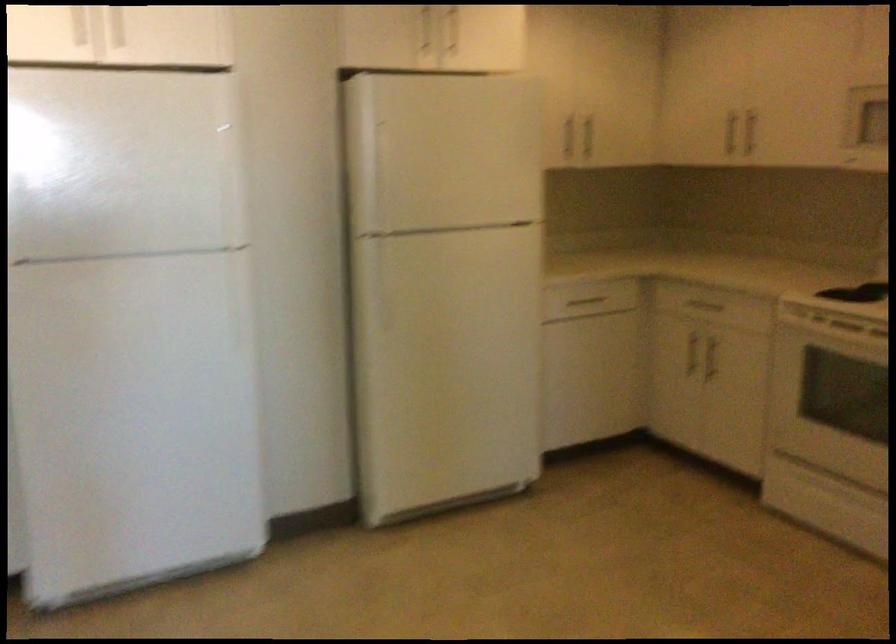
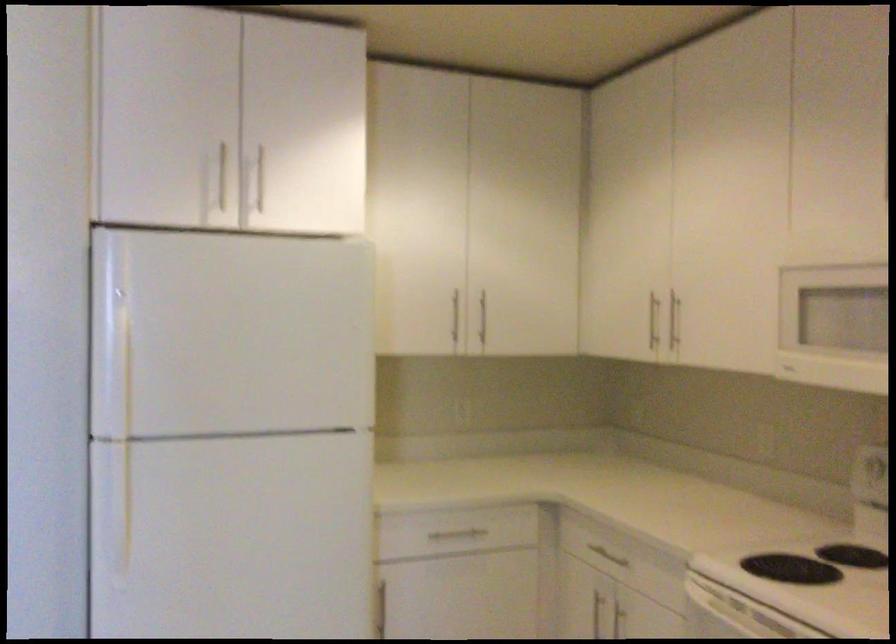
Find the pixel in the second image that matches point (586, 301) in the first image.

(455, 536)